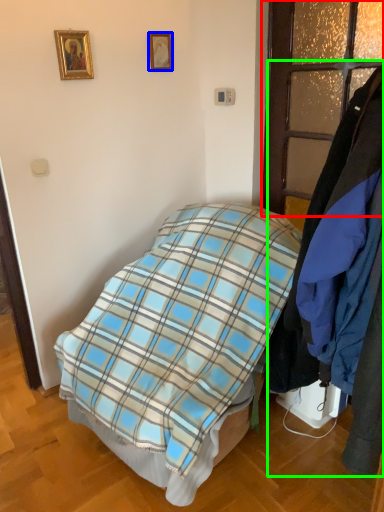
Question: Which object is the closest to the glass door (highlighted by a red box)? Choose among these: picture frame (highlighted by a blue box) or closet (highlighted by a green box).

Choices:
 (A) picture frame
 (B) closet

Answer: (A)